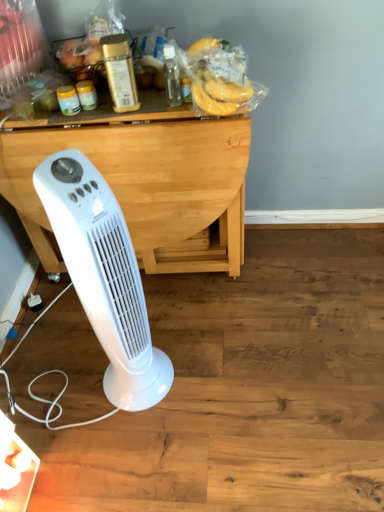
Describe the element at coordinates (104, 277) in the screenshot. I see `white plastic tower fan at lower left` at that location.

You are a GUI agent. You are given a task and a screenshot of the screen. Output one action in this format:
    pyautogui.click(x=<x>, y=<y>)
    Task: Click on the white plastic tower fan at lower left
    The image size is (384, 512).
    Given the screenshot: What is the action you would take?
    pyautogui.click(x=104, y=277)

Locate an element on the screen. This screenshot has height=512, width=384. yellow matte bananas at upper center is located at coordinates (219, 94).

The height and width of the screenshot is (512, 384). What are the coordinates of `wooden table at center` in the screenshot? It's located at (146, 181).

Between gold metallic container at upper center, the first bottle positioned from the left, and yellow matte bananas at upper center, which one appears on the right side from the viewer's perspective?

Positioned to the right is yellow matte bananas at upper center.

From a real-world perspective, is gold metallic container at upper center, the second bottle viewed from the right, beneath yellow matte bananas at upper center?

Incorrect, from a real-world perspective, gold metallic container at upper center, the second bottle viewed from the right, is higher than yellow matte bananas at upper center.

Can you confirm if gold metallic container at upper center, the second bottle viewed from the right, is shorter than yellow matte bananas at upper center?

In fact, gold metallic container at upper center, the second bottle viewed from the right, may be taller than yellow matte bananas at upper center.

Is gold metallic container at upper center, the second bottle viewed from the right, next to yellow matte bananas at upper center?

No.

Can you confirm if gold metallic container at upper center, the second bottle viewed from the right, is taller than transparent plastic bottle at center, which ranks as the first bottle in right-to-left order?

Indeed, gold metallic container at upper center, the second bottle viewed from the right, has a greater height compared to transparent plastic bottle at center, which ranks as the first bottle in right-to-left order.

From the picture: Is gold metallic container at upper center, the first bottle positioned from the left, positioned far away from transparent plastic bottle at center, which is the 2th bottle in left-to-right order?

gold metallic container at upper center, the first bottle positioned from the left, is near transparent plastic bottle at center, which is the 2th bottle in left-to-right order, not far away.

The image size is (384, 512). I want to click on bottle behind the gold metallic container at upper center, the second bottle viewed from the right, so click(171, 76).

Is gold metallic container at upper center, the second bottle viewed from the right, facing away from transparent plastic bottle at center, which is the 2th bottle in left-to-right order?

That's not correct — gold metallic container at upper center, the second bottle viewed from the right, is not looking away from transparent plastic bottle at center, which is the 2th bottle in left-to-right order.

Which of these two, wooden table at center or transparent plastic bottle at center, which is the 2th bottle in left-to-right order, is wider?

wooden table at center.

This screenshot has width=384, height=512. What are the coordinates of `table that is behind the transparent plastic bottle at center, which is the 2th bottle in left-to-right order` in the screenshot? It's located at (146, 181).

Is wooden table at center inside the boundaries of transparent plastic bottle at center, which ranks as the first bottle in right-to-left order, or outside?

wooden table at center is outside transparent plastic bottle at center, which ranks as the first bottle in right-to-left order.

From the image's perspective, which is below, wooden table at center or transparent plastic bottle at center, which ranks as the first bottle in right-to-left order?

wooden table at center is shown below in the image.

Which is further, (166,66) or (103,56)?

Positioned behind is point (166,66).

Is transparent plastic bottle at center, which ranks as the first bottle in right-to-left order, in front of gold metallic container at upper center, the second bottle viewed from the right?

That is False.

Is transparent plastic bottle at center, which ranks as the first bottle in right-to-left order, inside or outside of gold metallic container at upper center, the second bottle viewed from the right?

transparent plastic bottle at center, which ranks as the first bottle in right-to-left order, is outside gold metallic container at upper center, the second bottle viewed from the right.

Which object is wider, transparent plastic bottle at center, which ranks as the first bottle in right-to-left order, or gold metallic container at upper center, the second bottle viewed from the right?

With larger width is gold metallic container at upper center, the second bottle viewed from the right.

Relative to yellow matte bananas at upper center, is white plastic tower fan at lower left in front or behind?

white plastic tower fan at lower left is in front of yellow matte bananas at upper center.

How different are the orientations of white plastic tower fan at lower left and yellow matte bananas at upper center in degrees?

There is a 52.6-degree angle between the facing directions of white plastic tower fan at lower left and yellow matte bananas at upper center.

Locate an element on the screen. The height and width of the screenshot is (512, 384). home appliance on the left of the yellow matte bananas at upper center is located at coordinates (104, 277).

Does white plastic tower fan at lower left have a lesser height compared to yellow matte bananas at upper center?

In fact, white plastic tower fan at lower left may be taller than yellow matte bananas at upper center.

Is gold metallic container at upper center, the second bottle viewed from the right, at the back of wooden table at center?

No, wooden table at center is not facing the opposite direction of gold metallic container at upper center, the second bottle viewed from the right.

Between wooden table at center and gold metallic container at upper center, the second bottle viewed from the right, which one has larger width?

Wider between the two is wooden table at center.

Is wooden table at center in front of or behind gold metallic container at upper center, the second bottle viewed from the right, in the image?

wooden table at center is positioned farther from the viewer than gold metallic container at upper center, the second bottle viewed from the right.

Is gold metallic container at upper center, the second bottle viewed from the right, completely or partially inside wooden table at center?

No, wooden table at center does not contain gold metallic container at upper center, the second bottle viewed from the right.

Which of these two, white plastic tower fan at lower left or transparent plastic bottle at center, which is the 2th bottle in left-to-right order, stands taller?

Standing taller between the two is white plastic tower fan at lower left.

Locate an element on the screen. This screenshot has height=512, width=384. home appliance lying on the left of transparent plastic bottle at center, which ranks as the first bottle in right-to-left order is located at coordinates (104, 277).

How distant is white plastic tower fan at lower left from transparent plastic bottle at center, which is the 2th bottle in left-to-right order?

They are 24.69 inches apart.

This screenshot has width=384, height=512. What are the coordinates of `banana that appears behind the gold metallic container at upper center, the first bottle positioned from the left` in the screenshot? It's located at (219, 94).

You are a GUI agent. You are given a task and a screenshot of the screen. Output one action in this format:
    pyautogui.click(x=<x>, y=<y>)
    Task: Click on the bottle to the right of gold metallic container at upper center, the second bottle viewed from the right
    Image resolution: width=384 pixels, height=512 pixels.
    Given the screenshot: What is the action you would take?
    pyautogui.click(x=171, y=76)

Which object lies nearer to the anchor point yellow matte bananas at upper center, wooden table at center or white plastic tower fan at lower left?

wooden table at center.

When comparing their distances from wooden table at center, does yellow matte bananas at upper center or gold metallic container at upper center, the first bottle positioned from the left, seem further?

yellow matte bananas at upper center is further to wooden table at center.

Which object lies further to the anchor point white plastic tower fan at lower left, wooden table at center or transparent plastic bottle at center, which ranks as the first bottle in right-to-left order?

Among the two, transparent plastic bottle at center, which ranks as the first bottle in right-to-left order, is located further to white plastic tower fan at lower left.

Looking at the image, which one is located closer to wooden table at center, transparent plastic bottle at center, which is the 2th bottle in left-to-right order, or yellow matte bananas at upper center?

transparent plastic bottle at center, which is the 2th bottle in left-to-right order.

Which object lies nearer to the anchor point gold metallic container at upper center, the second bottle viewed from the right, white plastic tower fan at lower left or wooden table at center?

wooden table at center is positioned closer to the anchor gold metallic container at upper center, the second bottle viewed from the right.

From the image, which object appears to be farther from transparent plastic bottle at center, which is the 2th bottle in left-to-right order, yellow matte bananas at upper center or gold metallic container at upper center, the first bottle positioned from the left?

gold metallic container at upper center, the first bottle positioned from the left, is positioned further to the anchor transparent plastic bottle at center, which is the 2th bottle in left-to-right order.

Estimate the real-world distances between objects in this image. Which object is closer to wooden table at center, white plastic tower fan at lower left or gold metallic container at upper center, the first bottle positioned from the left?

gold metallic container at upper center, the first bottle positioned from the left, is positioned closer to the anchor wooden table at center.

Estimate the real-world distances between objects in this image. Which object is closer to gold metallic container at upper center, the second bottle viewed from the right, yellow matte bananas at upper center or transparent plastic bottle at center, which is the 2th bottle in left-to-right order?

transparent plastic bottle at center, which is the 2th bottle in left-to-right order, is closer to gold metallic container at upper center, the second bottle viewed from the right.

Find the location of a particular element. This screenshot has width=384, height=512. bottle between gold metallic container at upper center, the first bottle positioned from the left, and white plastic tower fan at lower left in the up-down direction is located at coordinates (171, 76).

This screenshot has height=512, width=384. What are the coordinates of `table between transparent plastic bottle at center, which ranks as the first bottle in right-to-left order, and white plastic tower fan at lower left in the up-down direction` in the screenshot? It's located at (146, 181).

Locate an element on the screen. The width and height of the screenshot is (384, 512). bottle between gold metallic container at upper center, the second bottle viewed from the right, and yellow matte bananas at upper center, in the horizontal direction is located at coordinates (171, 76).

Where is `banana that lies between transparent plastic bottle at center, which ranks as the first bottle in right-to-left order, and white plastic tower fan at lower left from top to bottom`? The height and width of the screenshot is (512, 384). banana that lies between transparent plastic bottle at center, which ranks as the first bottle in right-to-left order, and white plastic tower fan at lower left from top to bottom is located at coordinates (219, 94).